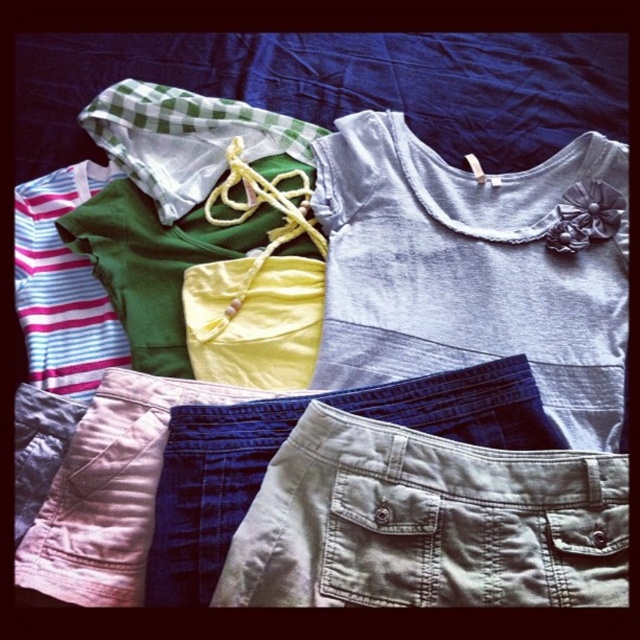
Question: Which point is closer to the camera?

Choices:
 (A) khaki cotton shorts at lower center
 (B) gray cotton shirt at upper right

Answer: (A)

Question: Is gray cotton shirt at upper right smaller than khaki cotton shorts at lower center?

Choices:
 (A) yes
 (B) no

Answer: (B)

Question: Which point appears farthest from the camera in this image?

Choices:
 (A) (372, 189)
 (B) (620, 513)

Answer: (A)

Question: Does gray cotton shirt at upper right have a lesser width compared to khaki cotton shorts at lower center?

Choices:
 (A) yes
 (B) no

Answer: (B)

Question: Can you confirm if gray cotton shirt at upper right is positioned to the left of khaki cotton shorts at lower center?

Choices:
 (A) no
 (B) yes

Answer: (A)